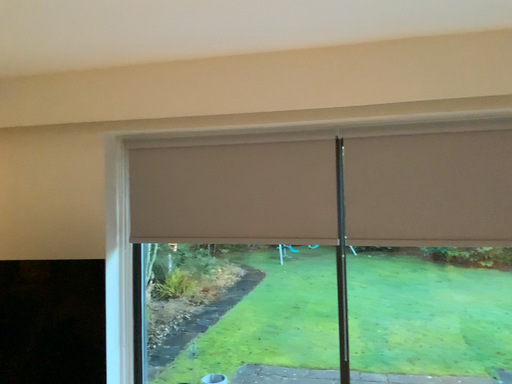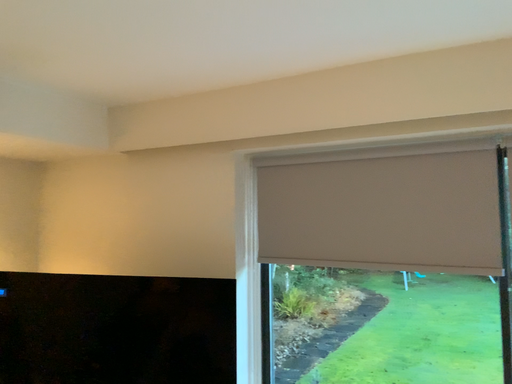
Question: Which way did the camera rotate in the video?

Choices:
 (A) rotated left
 (B) rotated right

Answer: (A)